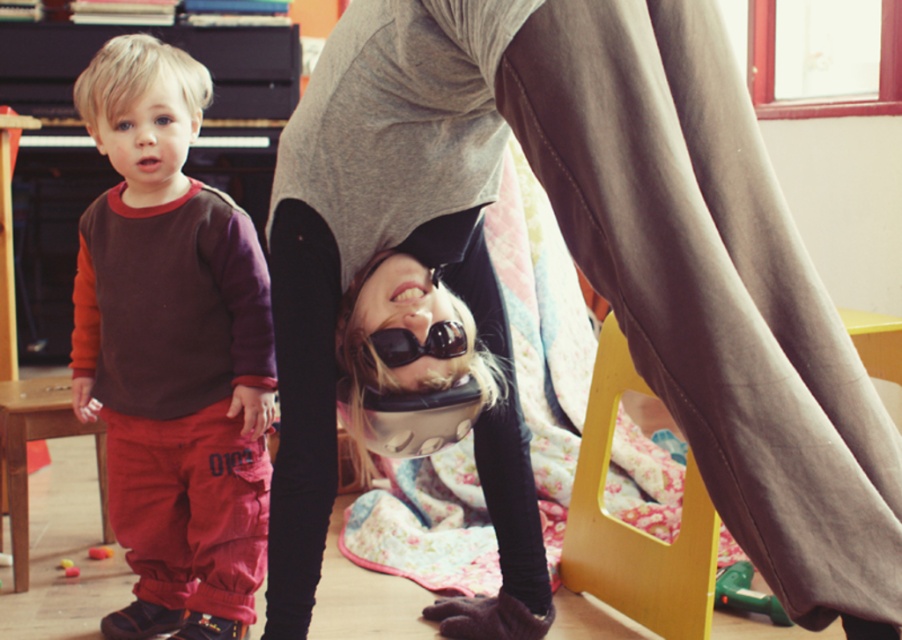
You are a photographer standing 1.5 meters away from the camera. You want to take a photo of the point at coordinates point (796, 307). Will you be able to focus on this point without moving closer?

The point (796, 307) is 1.17 meters from the camera. Since you are standing 1.5 meters away from the camera, you are farther than the point. Most cameras have a minimum focusing distance, but assuming standard settings, you might struggle to focus on something closer to the camera than your position. Move closer to within 1.17 meters for better focus.

You are a parent trying to retrieve the rubberized yellow toy at lower left for your child. The gray fabric pants at center belong to another child who is currently sitting. Can you safely walk between them to reach the toy?

The distance between the gray fabric pants at center and the rubberized yellow toy at lower left is 1.61 meters, which is a sufficient space for an adult to walk through safely without disturbing the sitting child.

You are a parent trying to dress your child. You have two items in the room, the gray fabric pants at center and the matte brown sweatshirt at left. If the distance between them is important for you to decide which to pick up first, can you tell which one is closer to you?

The gray fabric pants at center and matte brown sweatshirt at left are 24.26 inches apart, but the question does not provide information about your current position relative to the objects. Without knowing where you are standing, it is impossible to determine which item is closer.